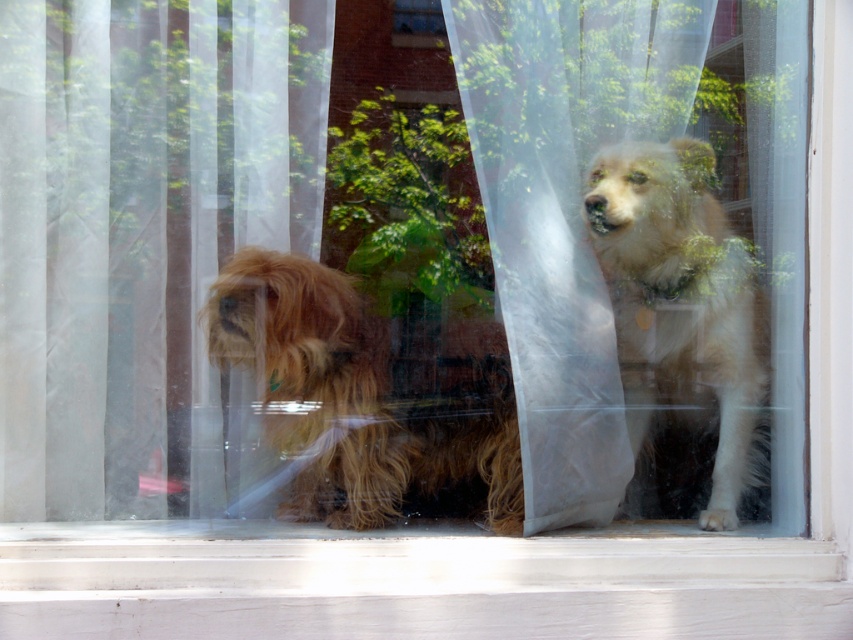
You are standing in front of the window and want to open the translucent white curtain at left to get a better view outside. The curtain is 6.24 feet away from you. If your arm can reach up to 5 feet, can you reach the curtain without moving closer?

The translucent white curtain at left is 6.24 feet away from the camera, so you cannot reach it with an arm that can only extend 5 feet. You need to move closer to reach it.

You are trying to determine if the translucent white curtain at left can cover the fuzzy brown dog at left when fully extended. Based on their sizes, can it cover the dog completely?

The translucent white curtain at left is narrower than the fuzzy brown dog at left, so it cannot fully cover the dog when extended.